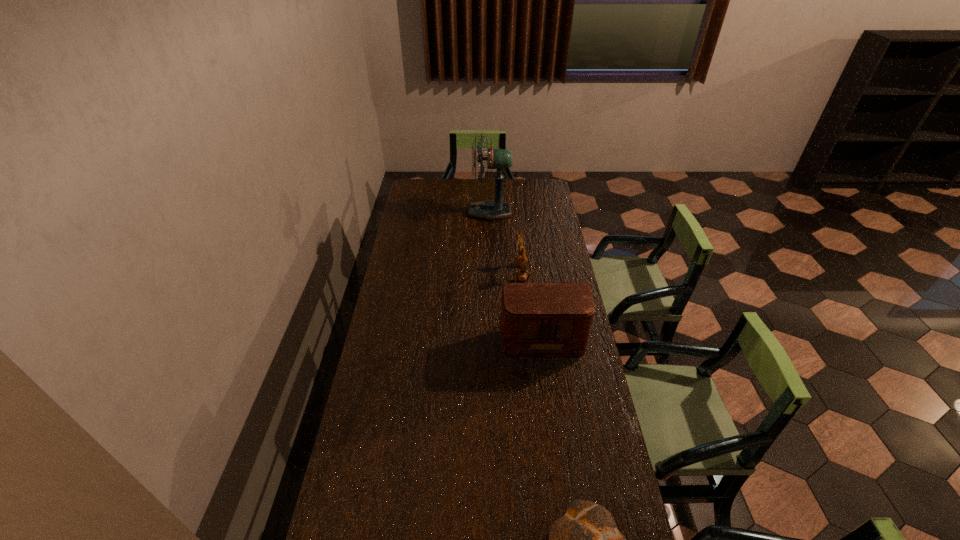
Where is `vacant region located on the front-facing side of the earphone`? The width and height of the screenshot is (960, 540). vacant region located on the front-facing side of the earphone is located at coordinates (470, 273).

Identify the location of vacant area situated on the front-facing side of the earphone. The width and height of the screenshot is (960, 540). (457, 273).

The width and height of the screenshot is (960, 540). I want to click on free space located on the front-facing side of the earphone, so click(x=488, y=273).

Identify the location of object at the right edge. The width and height of the screenshot is (960, 540). (544, 321).

You are a GUI agent. You are given a task and a screenshot of the screen. Output one action in this format:
    pyautogui.click(x=<x>, y=<y>)
    Task: Click on the vacant area at the far edge of the desktop
    
    Given the screenshot: What is the action you would take?
    pyautogui.click(x=475, y=197)

The image size is (960, 540). In order to click on vacant space at the left edge in this screenshot , I will do `click(413, 349)`.

In the image, there is a desktop. At what (x,y) coordinates should I click in order to perform the action: click on vacant space at the right edge. Please return your answer as a coordinate pair (x, y). The width and height of the screenshot is (960, 540). Looking at the image, I should click on (534, 204).

Where is `free space at the far left corner`? free space at the far left corner is located at coordinates (418, 185).

The width and height of the screenshot is (960, 540). I want to click on free space at the far right corner, so click(526, 198).

You are a GUI agent. You are given a task and a screenshot of the screen. Output one action in this format:
    pyautogui.click(x=<x>, y=<y>)
    Task: Click on the free space that is in between the fan and the second tallest object
    
    Given the screenshot: What is the action you would take?
    pyautogui.click(x=516, y=274)